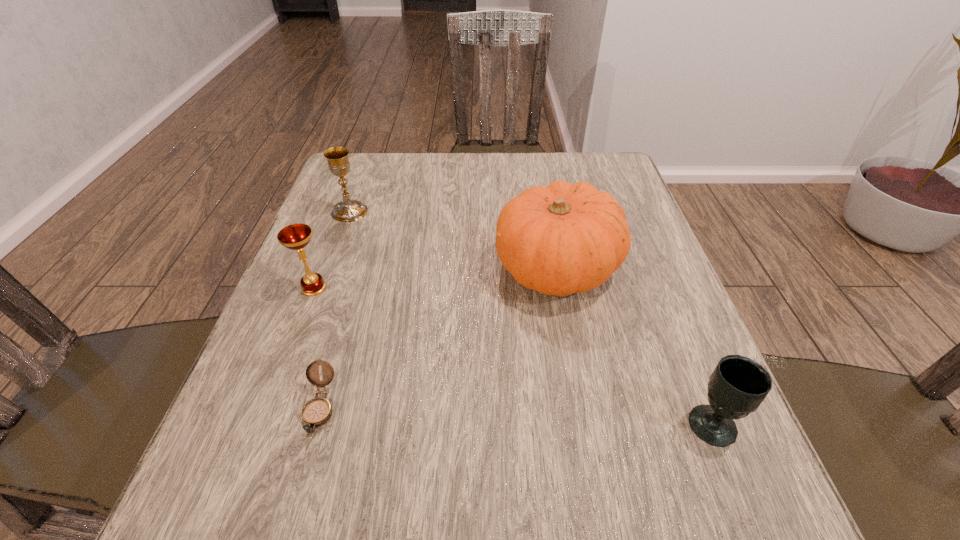
In order to click on free area in between the rightmost object and the second object from right to left in this screenshot , I will do `click(635, 346)`.

Where is `vacant area that lies between the second farthest chalice and the rightmost object`? vacant area that lies between the second farthest chalice and the rightmost object is located at coordinates (514, 356).

You are a GUI agent. You are given a task and a screenshot of the screen. Output one action in this format:
    pyautogui.click(x=<x>, y=<y>)
    Task: Click on the empty space that is in between the shortest object and the second object from right to left
    This screenshot has height=540, width=960.
    Given the screenshot: What is the action you would take?
    pyautogui.click(x=438, y=339)

Image resolution: width=960 pixels, height=540 pixels. Identify the location of empty space that is in between the farthest chalice and the second object from right to left. (453, 240).

You are a GUI agent. You are given a task and a screenshot of the screen. Output one action in this format:
    pyautogui.click(x=<x>, y=<y>)
    Task: Click on the free space that is in between the farthest chalice and the second object from right to left
    The image size is (960, 540).
    Given the screenshot: What is the action you would take?
    pyautogui.click(x=453, y=240)

Identify the location of empty location between the rightmost object and the compass. (516, 416).

Find the location of a particular element. The height and width of the screenshot is (540, 960). vacant space that's between the second farthest chalice and the farthest object is located at coordinates (332, 249).

Locate an element on the screen. empty location between the fourth object from left to right and the compass is located at coordinates (438, 339).

What are the coordinates of `free space that is in between the rightmost chalice and the compass` in the screenshot? It's located at (516, 416).

This screenshot has height=540, width=960. What are the coordinates of `vacant space in between the rightmost chalice and the second farthest chalice` in the screenshot? It's located at (514, 356).